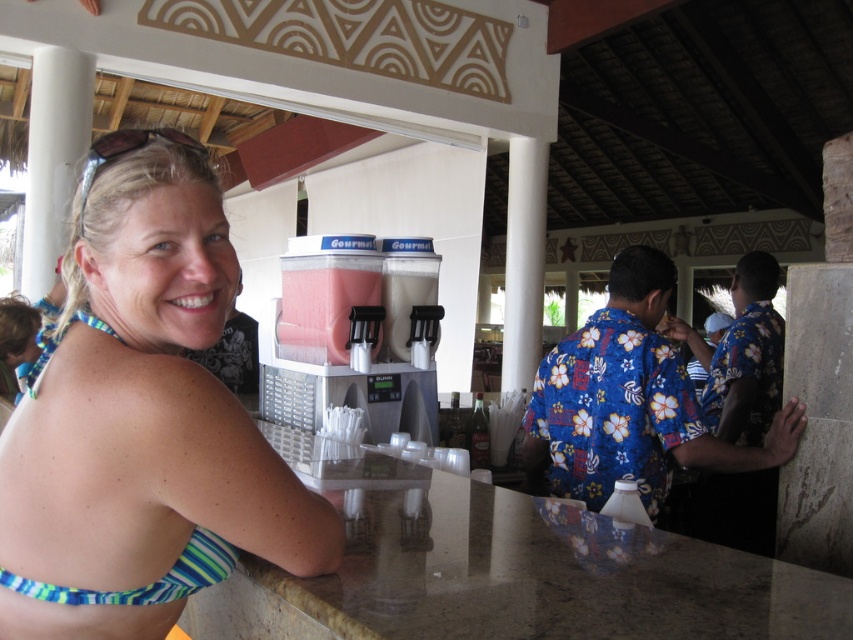
Which is more to the right, blue striped bikini top at left or translucent plastic cup at center?

translucent plastic cup at center is more to the right.

Can you confirm if blue striped bikini top at left is smaller than translucent plastic cup at center?

Actually, blue striped bikini top at left might be larger than translucent plastic cup at center.

The height and width of the screenshot is (640, 853). What do you see at coordinates (141, 419) in the screenshot? I see `blue striped bikini top at left` at bounding box center [141, 419].

Where is `blue striped bikini top at left`? This screenshot has height=640, width=853. blue striped bikini top at left is located at coordinates (141, 419).

Who is positioned more to the right, blue striped bikini top at left or blue floral shirt at center?

blue floral shirt at center is more to the right.

Is blue striped bikini top at left to the right of blue floral shirt at center from the viewer's perspective?

Incorrect, blue striped bikini top at left is not on the right side of blue floral shirt at center.

Where is `blue striped bikini top at left`? This screenshot has height=640, width=853. blue striped bikini top at left is located at coordinates (141, 419).

The width and height of the screenshot is (853, 640). What are the coordinates of `blue striped bikini top at left` in the screenshot? It's located at (141, 419).

Who is taller, blue floral shirt at center or translucent plastic cup at center?

blue floral shirt at center

The width and height of the screenshot is (853, 640). What do you see at coordinates (631, 401) in the screenshot?
I see `blue floral shirt at center` at bounding box center [631, 401].

Where is `blue floral shirt at center`? blue floral shirt at center is located at coordinates (631, 401).